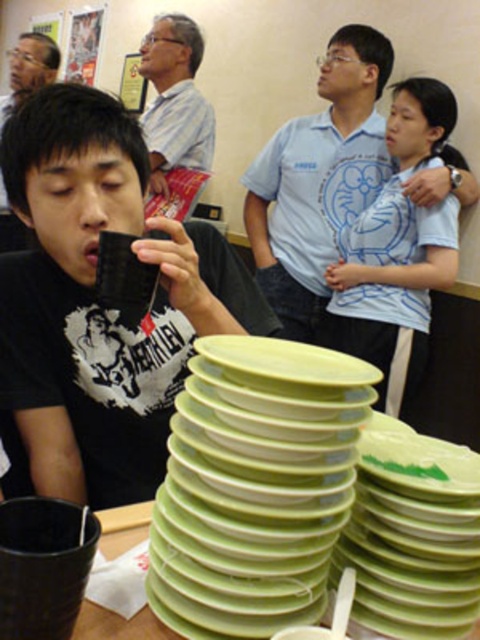
You are at a social event and see the black matte cup at lower left and the matte white shirt at upper center. Which object is positioned lower in the image?

The black matte cup at lower left is positioned lower than the matte white shirt at upper center.

You are at a party and want to grab a plate from the green plastic plates at lower center without knocking over the matte black mug at left. Based on their positions, which direction should you move the mug to make space?

The matte black mug at left is positioned on the left side of green plastic plates at lower center. To make space, move the mug to the right side of the plates.